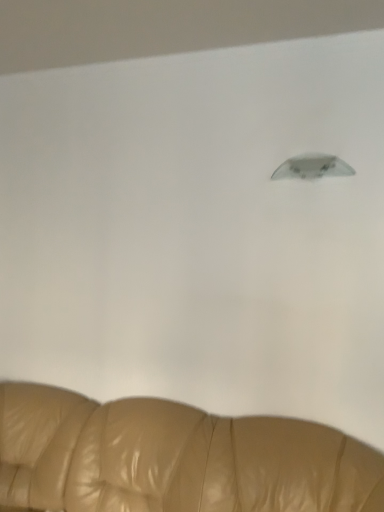
Consider the image. In order to face tan leather couch at lower center, should I rotate leftwards or rightwards?

To face it directly, rotate left by 11.186 degrees.

What do you see at coordinates (173, 458) in the screenshot? Image resolution: width=384 pixels, height=512 pixels. I see `tan leather couch at lower center` at bounding box center [173, 458].

Image resolution: width=384 pixels, height=512 pixels. What are the coordinates of `tan leather couch at lower center` in the screenshot? It's located at (173, 458).

This screenshot has height=512, width=384. I want to click on tan leather couch at lower center, so click(x=173, y=458).